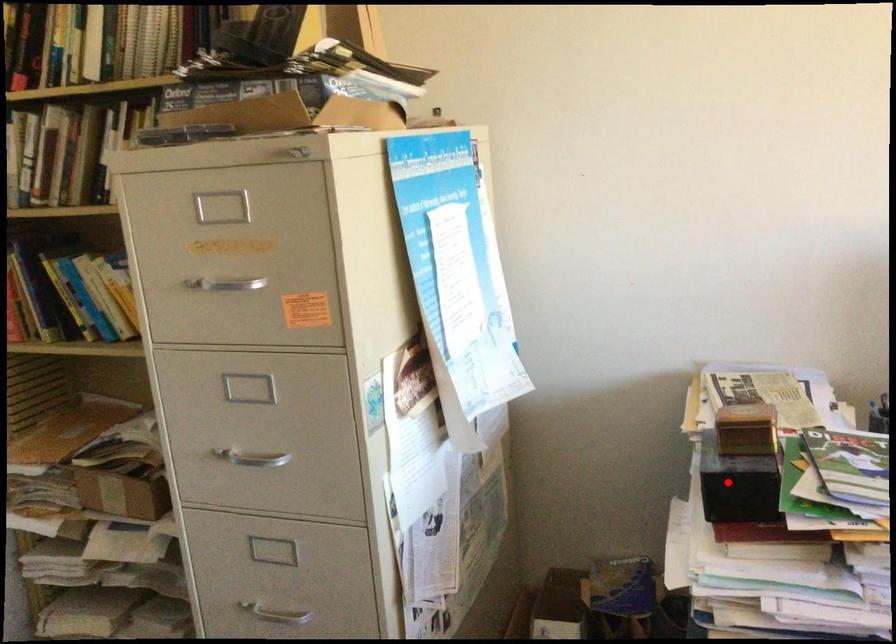
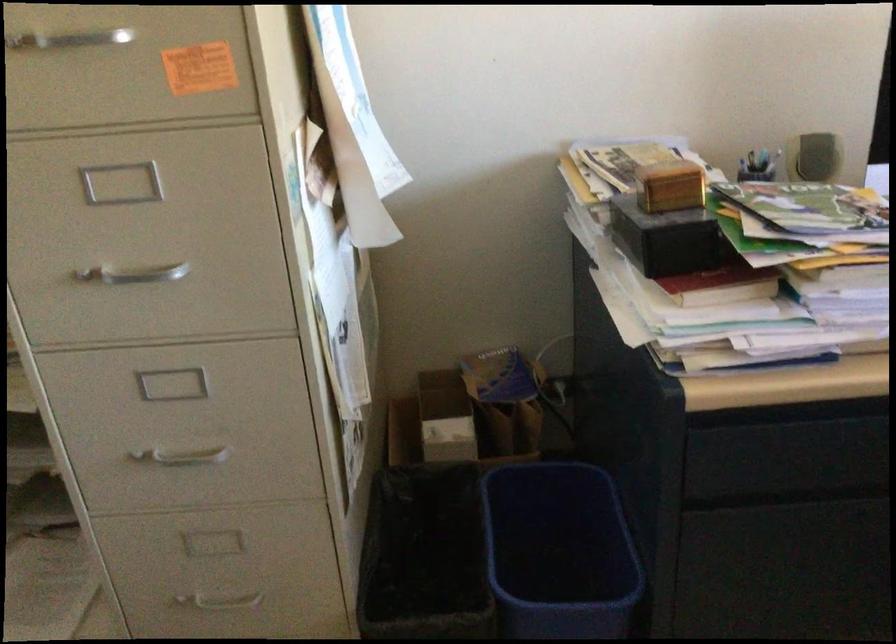
Locate, in the second image, the point that corresponds to the highlighted location in the first image.

(668, 239)